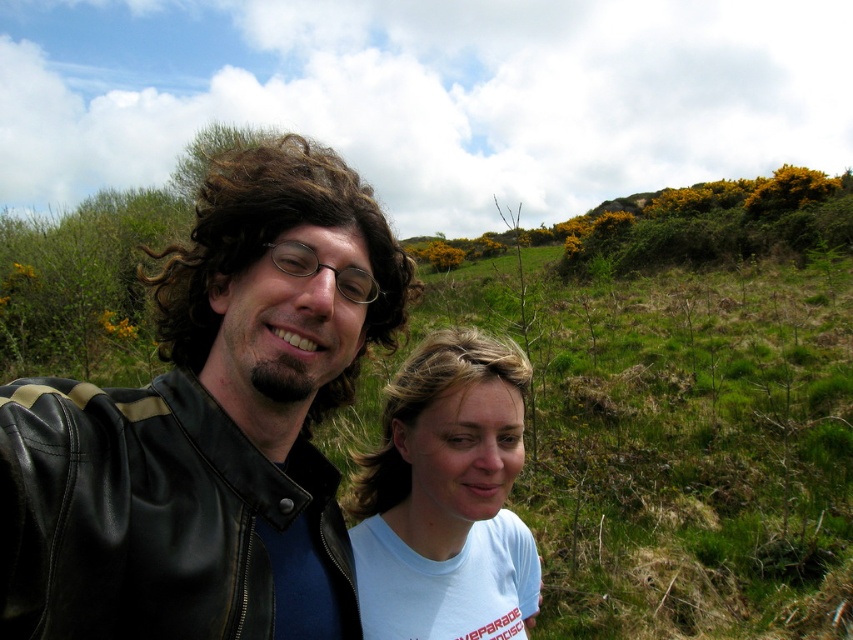
You are standing at the point with coordinates point (454,294) and want to walk towards the camera. Which direction should you move relative to the other point point (294,580)?

You should move towards point (294,580) because it is in front of point (454,294), so moving towards it would be towards the camera.

In the scene shown: You are standing in the scene and want to take a photo of the green grassy hillside at upper center. According to the coordinates provided, where should you aim your camera?

The green grassy hillside at upper center is located at coordinates point (679, 442), so you should aim your camera there to capture it.

You are trying to locate the black leather jacket at center in the image. According to the coordinates provided, where exactly is it positioned?

The black leather jacket at center is located at point coordinates of 0.669 on the x axis and 0.246 on the y axis.